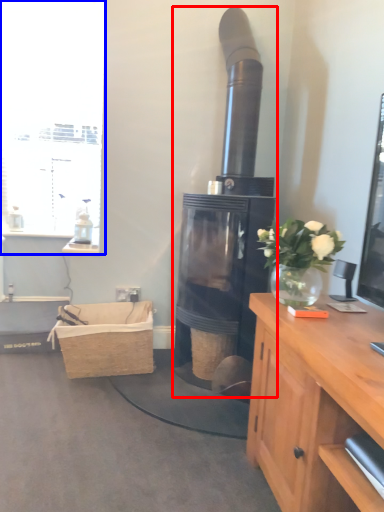
Question: Which object appears closest to the camera in this image, fireplace (highlighted by a red box) or window (highlighted by a blue box)?

Choices:
 (A) fireplace
 (B) window

Answer: (A)